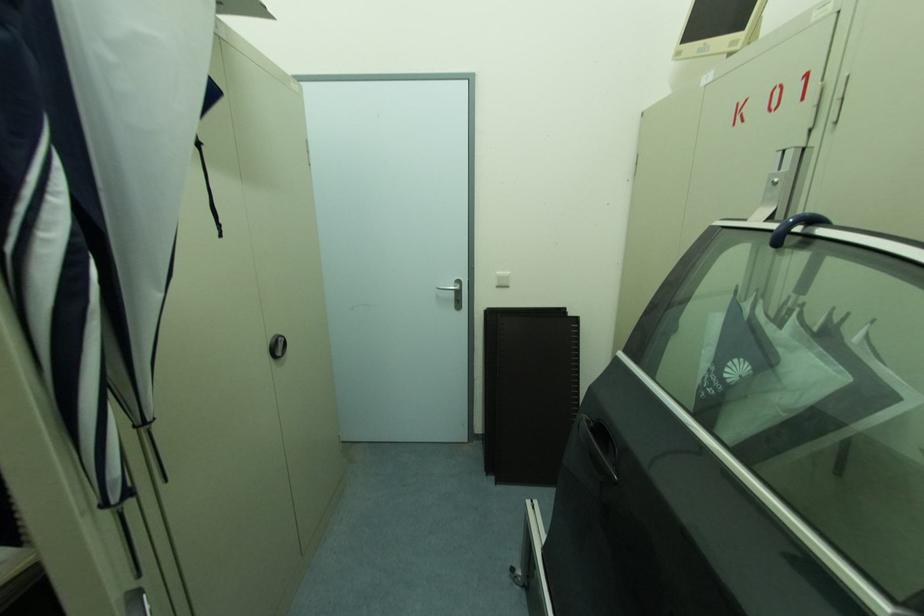
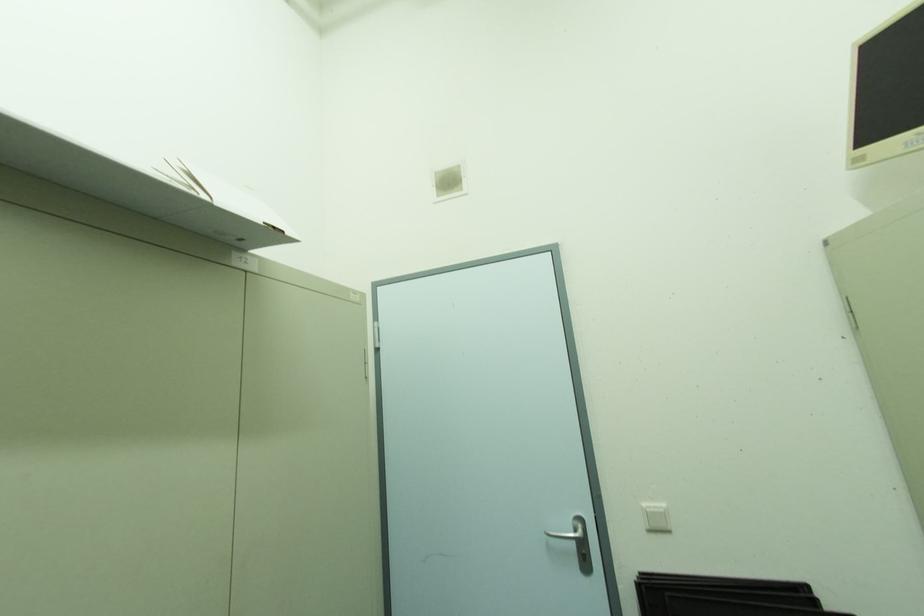
The first image is from the beginning of the video and the second image is from the end. How did the camera likely rotate when shooting the video?

The camera's rotation is toward left-up.